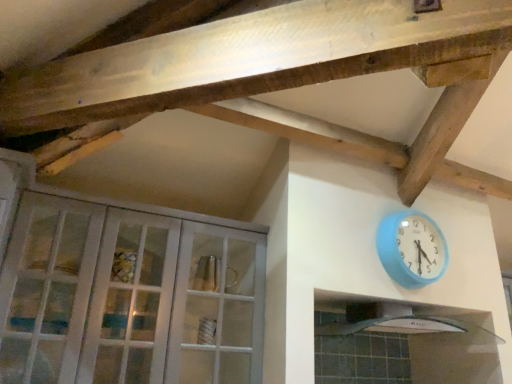
Question: From a real-world perspective, is white glass cabinet at left above or below blue plastic wall clock at upper right?

Choices:
 (A) below
 (B) above

Answer: (A)

Question: Visually, is white glass cabinet at left positioned to the left or to the right of blue plastic wall clock at upper right?

Choices:
 (A) left
 (B) right

Answer: (A)

Question: Which of these objects is positioned farthest from the white glass cabinet at left?

Choices:
 (A) blue plastic wall clock at upper right
 (B) white glossy exhaust hood at lower right

Answer: (B)

Question: Considering the real-world distances, which object is closest to the blue plastic wall clock at upper right?

Choices:
 (A) white glass cabinet at left
 (B) white glossy exhaust hood at lower right

Answer: (B)